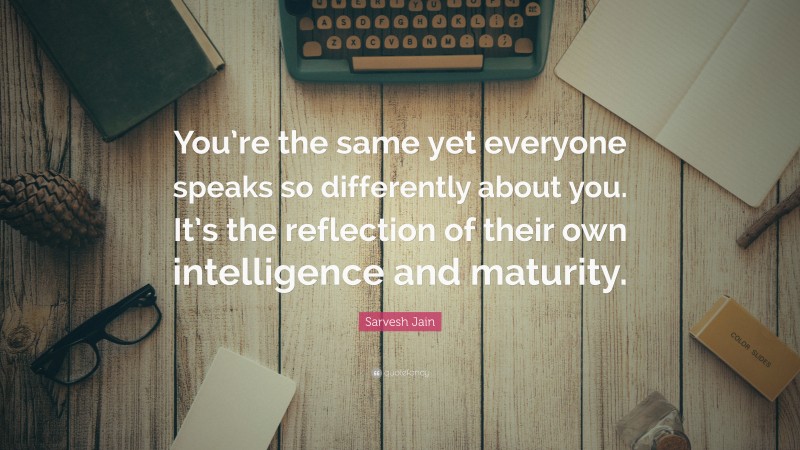
Locate an element on the screen. This screenshot has width=800, height=450. keyboard is located at coordinates (418, 32).